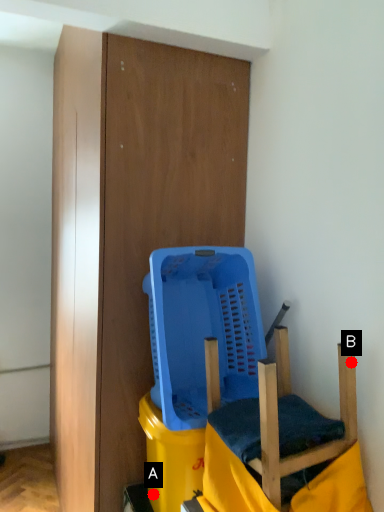
Question: Two points are circled on the image, labeled by A and B beside each circle. Which point appears farthest from the camera in this image?

Choices:
 (A) A is further
 (B) B is further

Answer: (A)